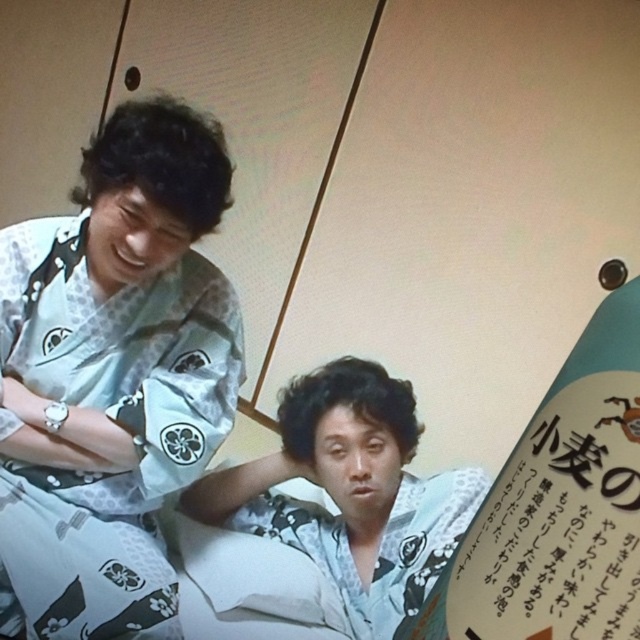
Question: Is white floral kimono at left bigger than white floral kimono at center?

Choices:
 (A) yes
 (B) no

Answer: (A)

Question: Which of the following is the farthest from the observer?

Choices:
 (A) white floral kimono at center
 (B) white floral kimono at left

Answer: (A)

Question: Which object appears closest to the camera in this image?

Choices:
 (A) white floral kimono at left
 (B) white floral kimono at center

Answer: (A)

Question: Does white floral kimono at left appear on the left side of white floral kimono at center?

Choices:
 (A) yes
 (B) no

Answer: (A)

Question: Is white floral kimono at left to the right of white floral kimono at center from the viewer's perspective?

Choices:
 (A) no
 (B) yes

Answer: (A)